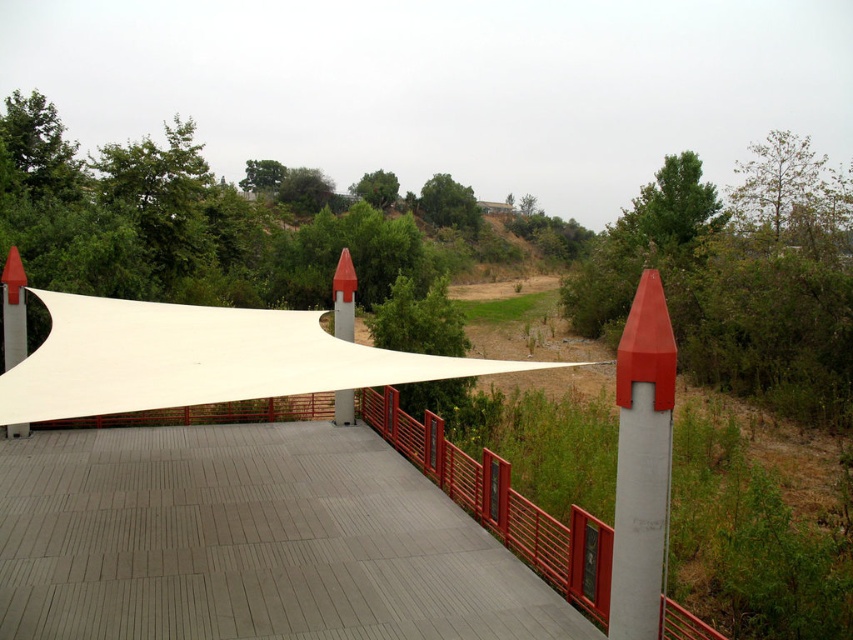
Who is positioned more to the left, metallic red railing at center-right or matte white pole at right?

metallic red railing at center-right is more to the left.

Which is more to the right, metallic red railing at center-right or matte white pole at right?

Positioned to the right is matte white pole at right.

Find the location of a particular element. metallic red railing at center-right is located at coordinates (x=502, y=504).

You are a GUI agent. You are given a task and a screenshot of the screen. Output one action in this format:
    pyautogui.click(x=<x>, y=<y>)
    Task: Click on the metallic red railing at center-right
    
    Given the screenshot: What is the action you would take?
    pyautogui.click(x=502, y=504)

Can you confirm if gray wood path at center is bigger than metallic red railing at center-right?

No.

Who is positioned more to the left, gray wood path at center or metallic red railing at center-right?

gray wood path at center

Identify the location of gray wood path at center. This screenshot has width=853, height=640. (250, 541).

Does point (547, 364) come farther from viewer compared to point (630, 572)?

Yes, point (547, 364) is behind point (630, 572).

Where is `white fabric canopy at center`? white fabric canopy at center is located at coordinates (200, 358).